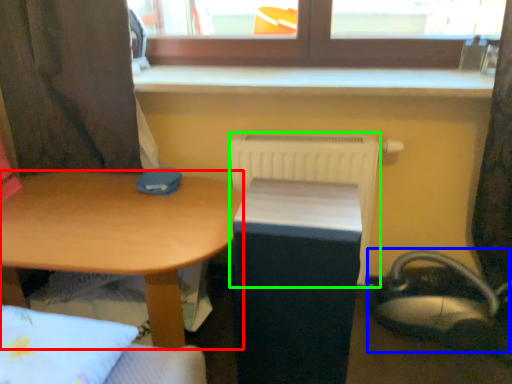
Question: Estimate the real-world distances between objects in this image. Which object is closer to desk (highlighted by a red box), swivel chair (highlighted by a blue box) or radiator (highlighted by a green box)?

Choices:
 (A) swivel chair
 (B) radiator

Answer: (B)